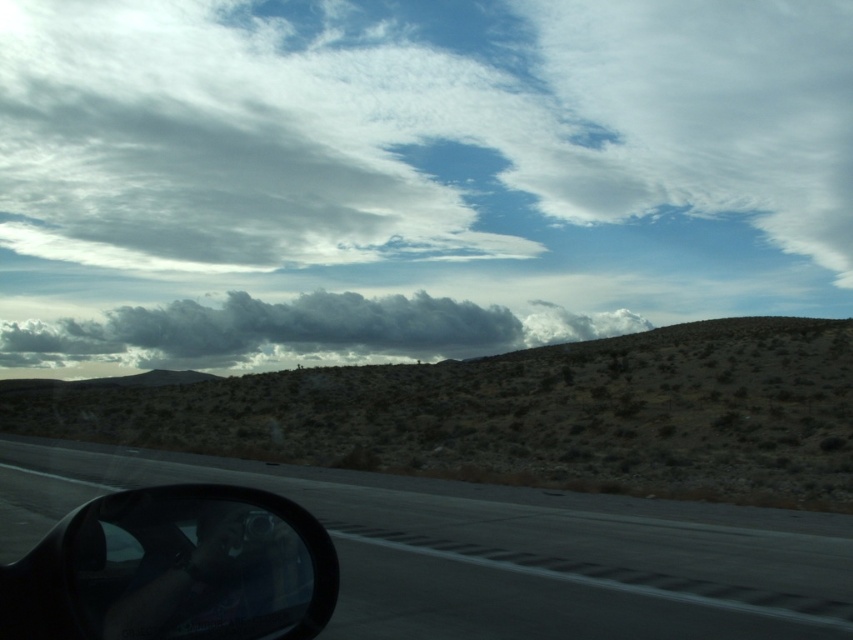
You are sitting in the driver seat of the car and looking out through the windshield. There are two points marked on the road ahead, one at coordinate point (128, 509) and the other at point (256, 308). Which point is closer to you?

Point (128, 509) is closer to the viewer than point (256, 308).

You are a passenger in a car and want to take a photo of the asphalt road at lower left and the black glossy side mirror at lower left. Which object is closer to you so that it appears larger in the photo?

The asphalt road at lower left is further to the viewer than the black glossy side mirror at lower left, so the side mirror will appear larger in the photo because it is closer.